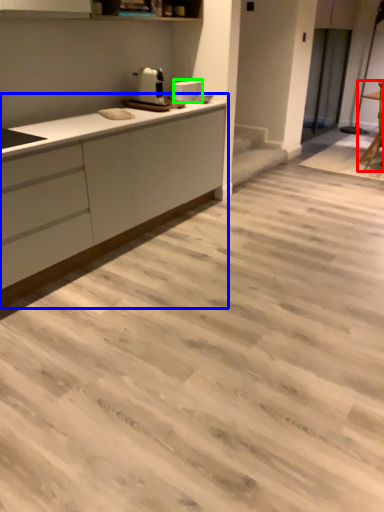
Question: Which is nearer to the chair (highlighted by a red box)? countertop (highlighted by a blue box) or appliance (highlighted by a green box).

Choices:
 (A) countertop
 (B) appliance

Answer: (B)